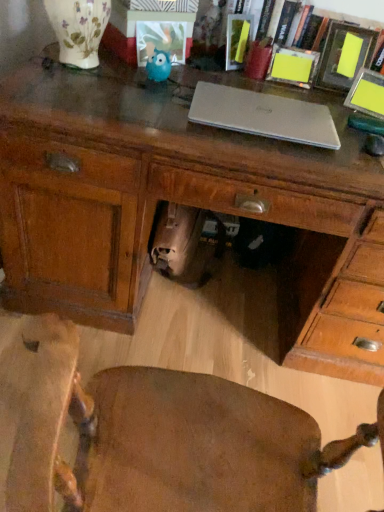
Locate an element on the screen. vacant point to the left of blue fuzzy owl at center is located at coordinates (107, 73).